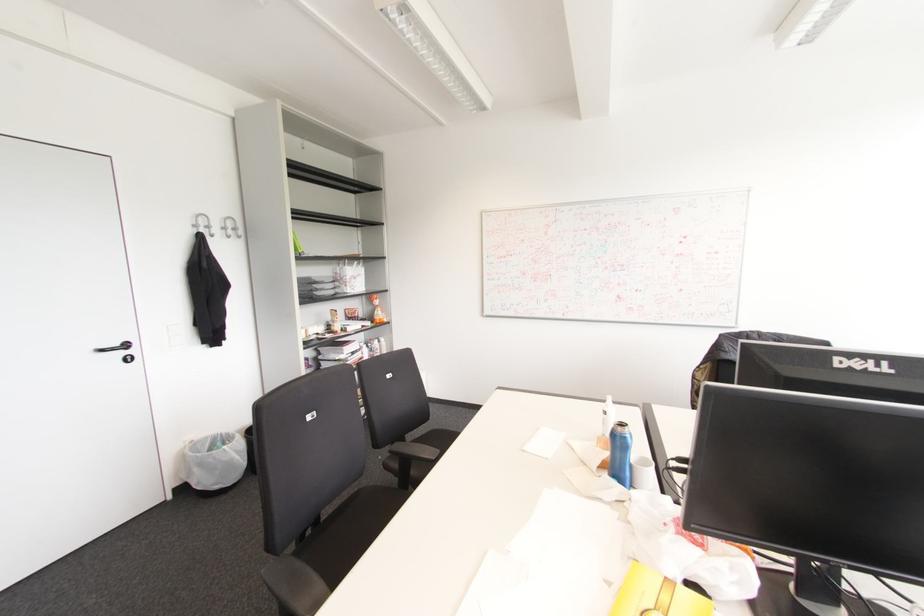
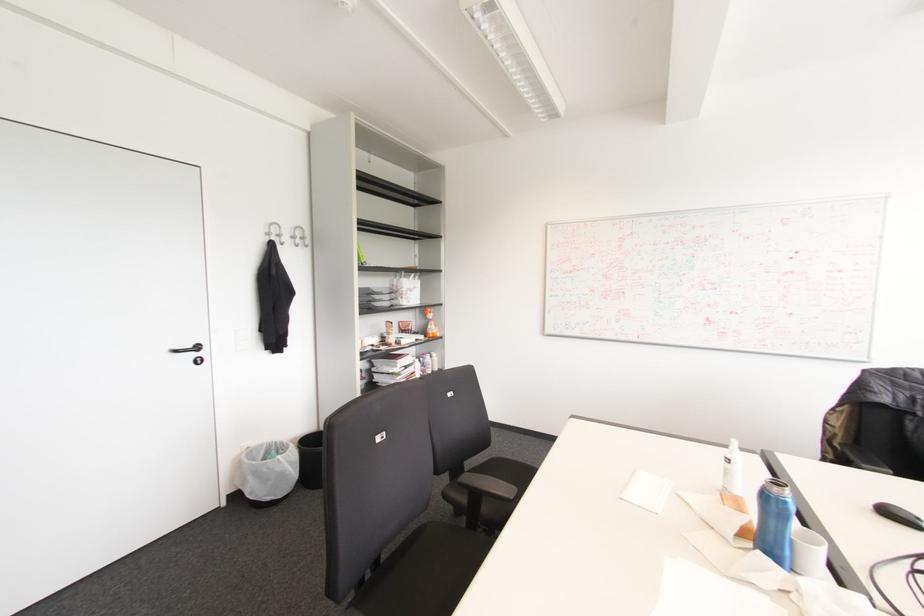
The point at (195, 469) is marked in the first image. Where is the corresponding point in the second image?

(249, 477)